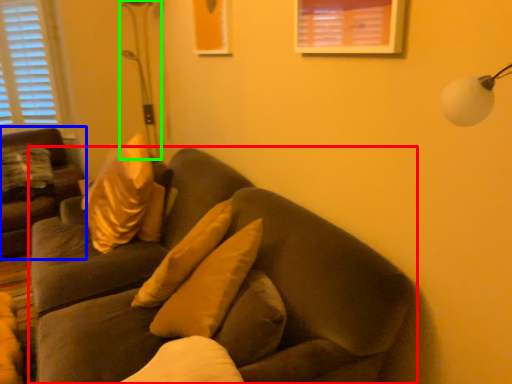
Question: Which object is positioned closest to studio couch (highlighted by a red box)? Select from studio couch (highlighted by a blue box) and table lamp (highlighted by a green box).

Choices:
 (A) studio couch
 (B) table lamp

Answer: (A)